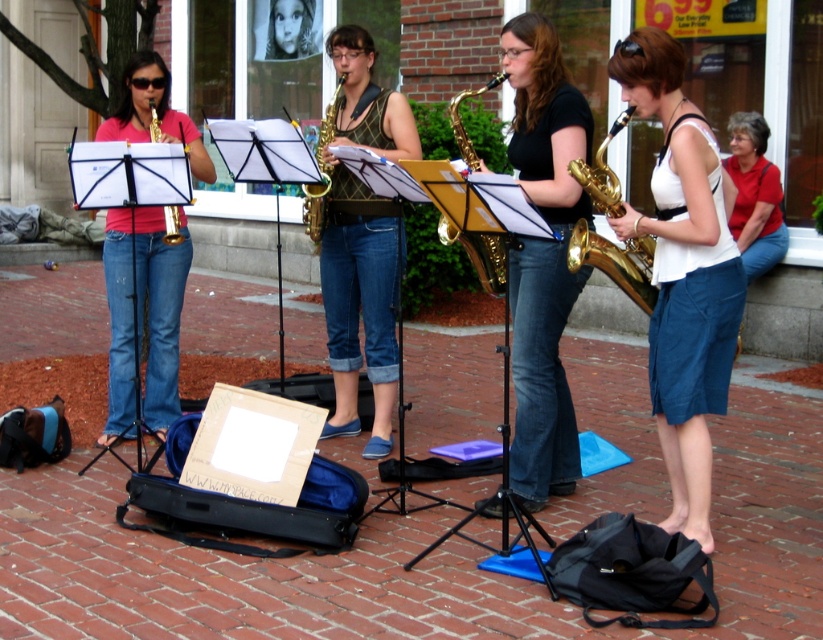
Question: Among these points, which one is nearest to the camera?

Choices:
 (A) (119, 300)
 (B) (712, 362)
 (C) (157, 131)

Answer: (B)

Question: Is white cotton shirt at upper right in front of gold shiny saxophone at center?

Choices:
 (A) yes
 (B) no

Answer: (B)

Question: Does black denim jeans at center come in front of gold shiny saxophone at center?

Choices:
 (A) no
 (B) yes

Answer: (B)

Question: In this image, where is brick pavement at lower center located relative to gold shiny trumpet at center?

Choices:
 (A) right
 (B) left

Answer: (A)

Question: Which object is farther from the camera taking this photo?

Choices:
 (A) white cotton shirt at upper right
 (B) matte white tank top at center

Answer: (A)

Question: Which point is closer to the camera taking this photo?

Choices:
 (A) (574, 100)
 (B) (177, 380)

Answer: (A)